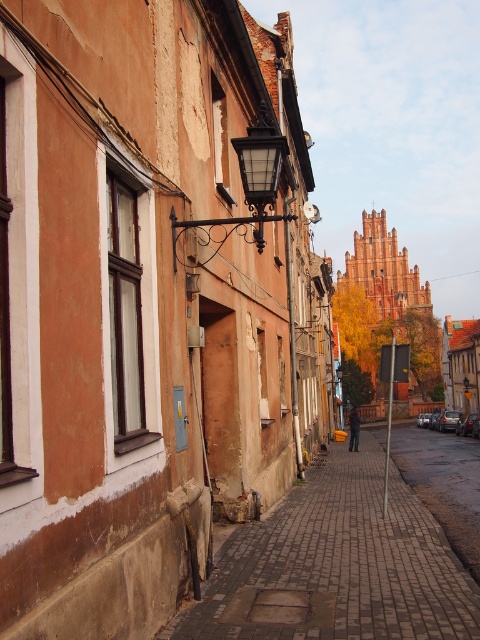
Question: Which object appears closest to the camera in this image?

Choices:
 (A) brick sidewalk at center
 (B) brick paved sidewalk at center

Answer: (B)

Question: Is brick paved sidewalk at center below brick sidewalk at center?

Choices:
 (A) no
 (B) yes

Answer: (A)

Question: In this image, where is brick paved sidewalk at center located relative to brick sidewalk at center?

Choices:
 (A) left
 (B) right

Answer: (A)

Question: Does brick paved sidewalk at center appear over brick sidewalk at center?

Choices:
 (A) no
 (B) yes

Answer: (B)